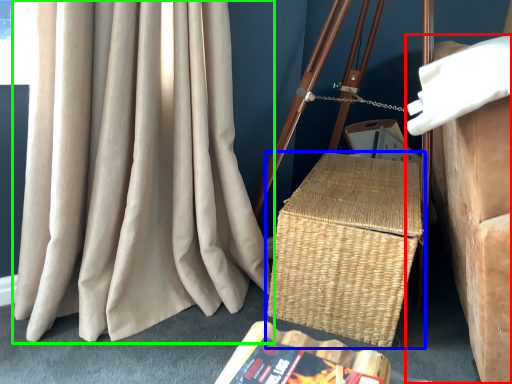
Question: Which object is positioned closest to furniture (highlighted by a red box)? Select from picnic basket (highlighted by a blue box) and curtain (highlighted by a green box).

Choices:
 (A) picnic basket
 (B) curtain

Answer: (A)